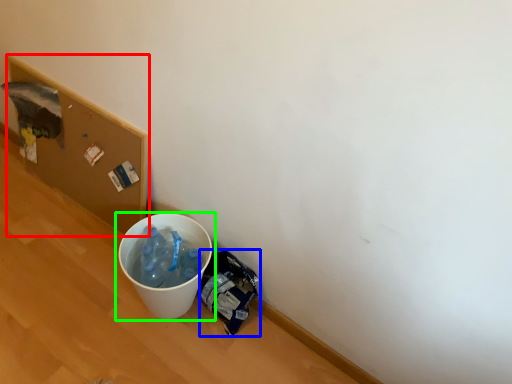
Question: Which is farther away from cardboard box (highlighted by a red box)? garbage (highlighted by a blue box) or waste container (highlighted by a green box)?

Choices:
 (A) garbage
 (B) waste container

Answer: (A)